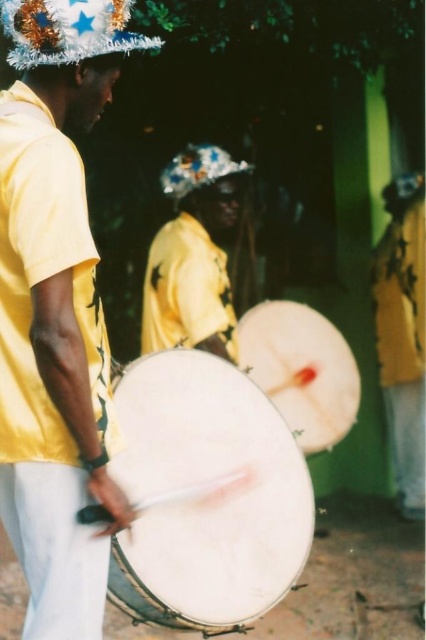
You are standing in the crowd watching the cultural performance. The drummer in the yellow matte shirt at center is performing. If you want to give him a flower that is 1 foot long, can you reach him without moving closer?

The yellow matte shirt at center is 10.54 feet away from the viewer. Since the flower is only 1 foot long, the distance is too great to reach him without moving closer.

You are a photographer trying to capture the central figure in the scene. The yellow matte shirt at center and the white matte drum at center are both in your frame. Which object should you focus on if you want to highlight the thinner one?

The yellow matte shirt at center is thinner than the white matte drum at center, so you should focus on the yellow matte shirt at center to highlight the thinner one.

You are a photographer trying to capture the central performer. Since the white drum at center and the yellow matte shirt at center are both in your view, which one is closer to the camera?

The white drum at center is positioned under the yellow matte shirt at center, so the white drum at center is closer to the camera than the yellow matte shirt at center.